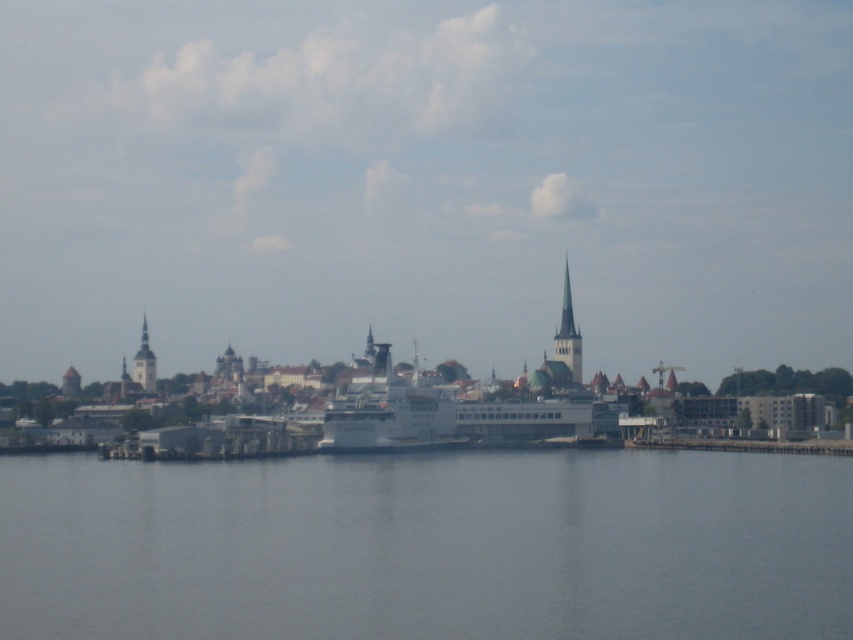
Question: Among these objects, which one is nearest to the camera?

Choices:
 (A) white matte ship at center
 (B) smooth stone tower at left
 (C) green stone spire at center

Answer: (A)

Question: Which point appears closest to the camera in this image?

Choices:
 (A) (364, 410)
 (B) (567, 356)

Answer: (A)

Question: Among these objects, which one is nearest to the camera?

Choices:
 (A) smooth stone tower at left
 (B) green stone spire at center
 (C) green stone tower at center

Answer: (B)

Question: Can you confirm if gray water at center is smaller than white matte ship at center?

Choices:
 (A) no
 (B) yes

Answer: (A)

Question: Does green stone spire at center have a lesser width compared to smooth stone tower at left?

Choices:
 (A) yes
 (B) no

Answer: (A)

Question: In this image, where is white matte ship at center located relative to green stone tower at center?

Choices:
 (A) right
 (B) left

Answer: (B)